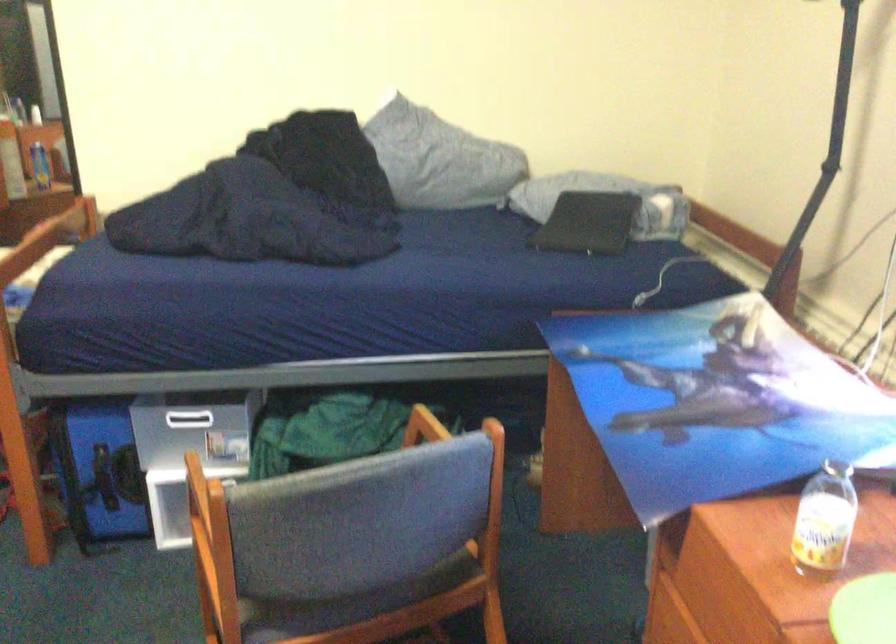
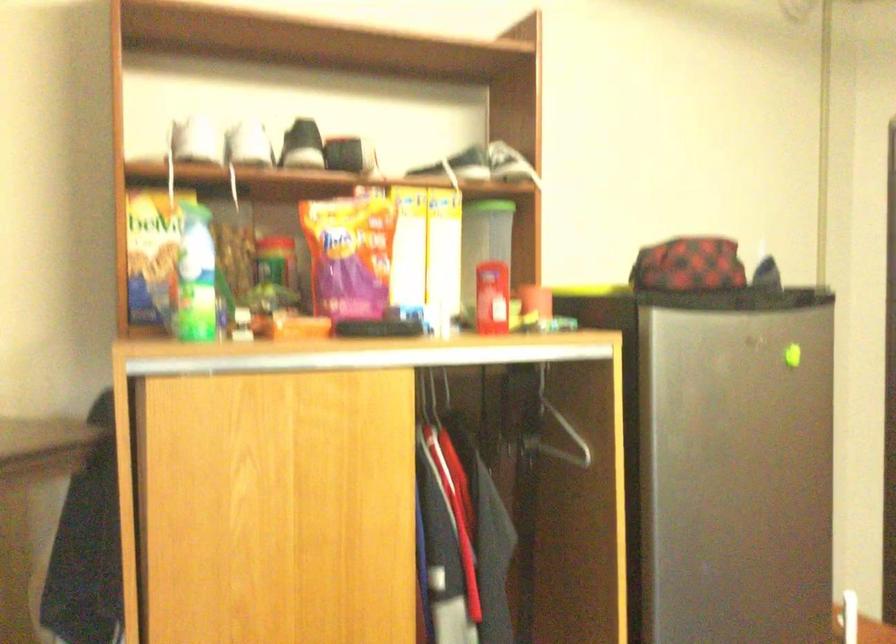
Question: How did the camera likely rotate?

Choices:
 (A) Left
 (B) Right
 (C) Up
 (D) Down

Answer: (A)